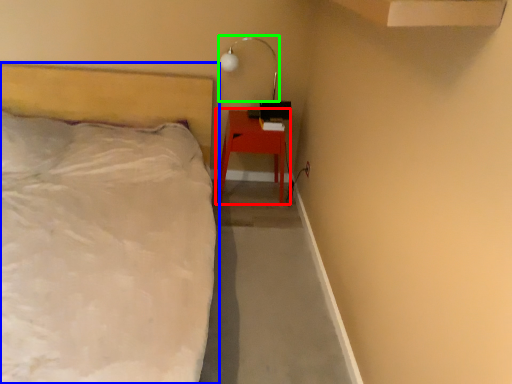
Question: Which object is the farthest from nightstand (highlighted by a red box)? Choose among these: bed (highlighted by a blue box) or lamp (highlighted by a green box).

Choices:
 (A) bed
 (B) lamp

Answer: (A)